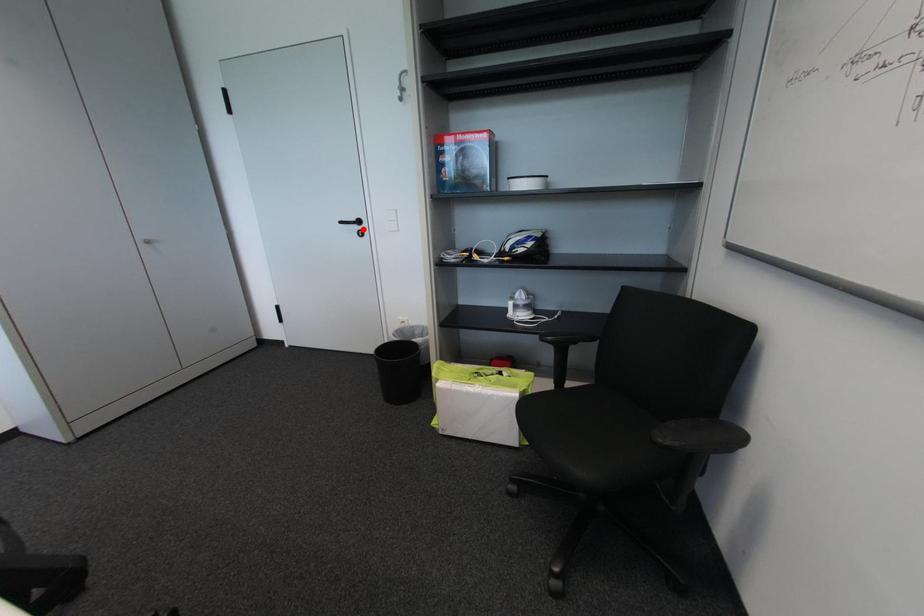
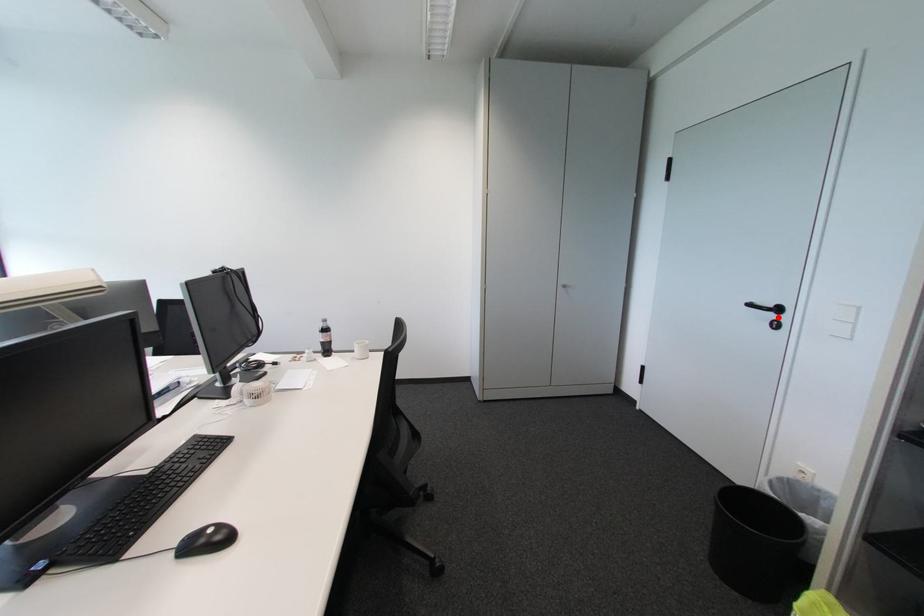
I am providing you with two images of the same scene from different viewpoints. A red point is marked on the first image and another point is marked on the second image. Are the points marked in image1 and image2 representing the same 3D position?

Yes